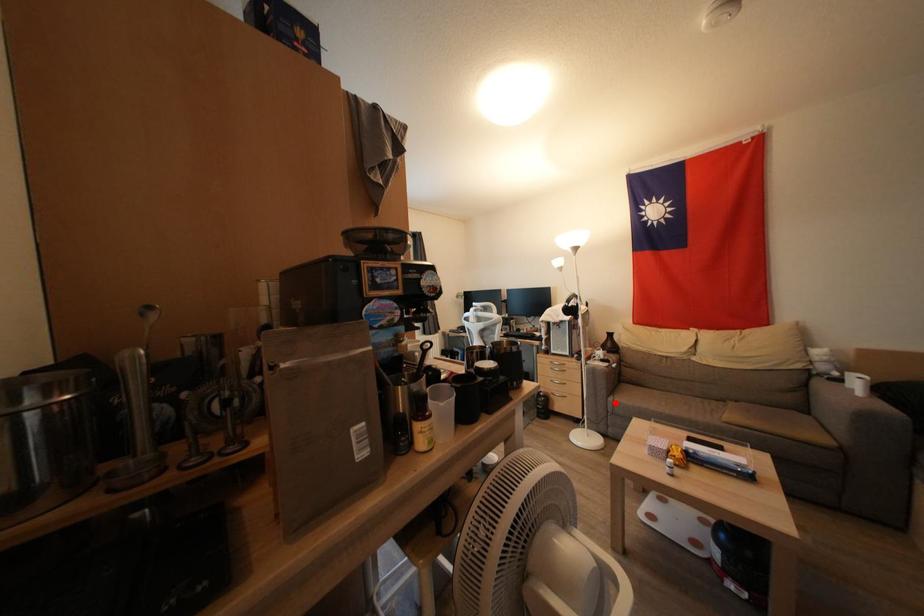
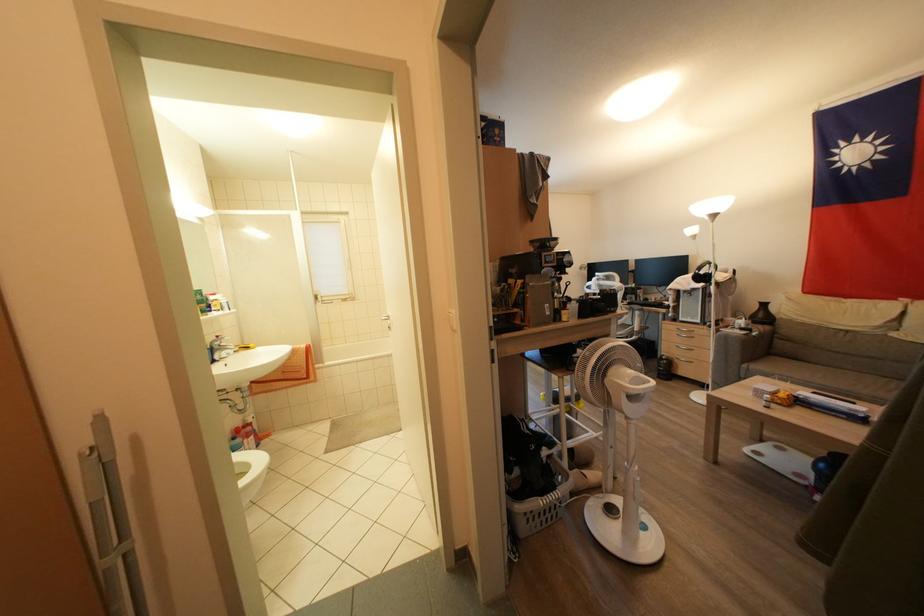
Question: I am providing you with two images of the same scene from different viewpoints. Image1 has a red point marked. In image2, the corresponding 3D location appears at what relative position? Reply with the corresponding letter.

Choices:
 (A) Closer
 (B) Farther

Answer: (A)